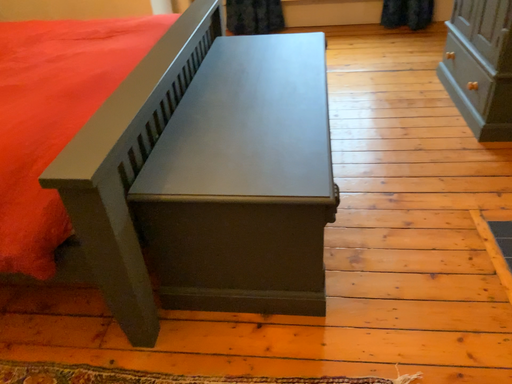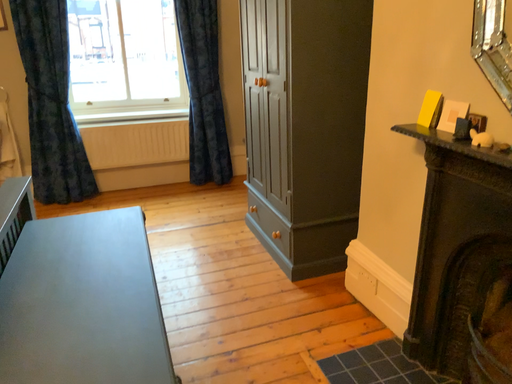
Question: How did the camera likely rotate when shooting the video?

Choices:
 (A) rotated left
 (B) rotated right

Answer: (B)